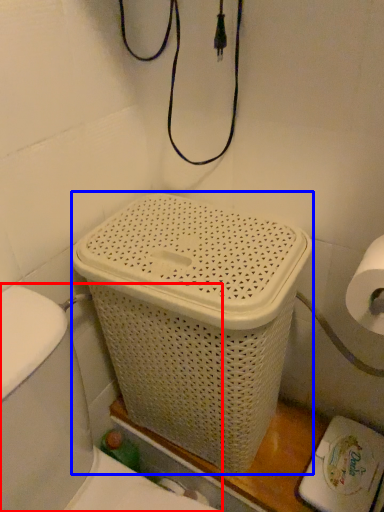
Question: Among these objects, which one is nearest to the camera, sink (highlighted by a red box) or basket container (highlighted by a blue box)?

Choices:
 (A) sink
 (B) basket container

Answer: (A)